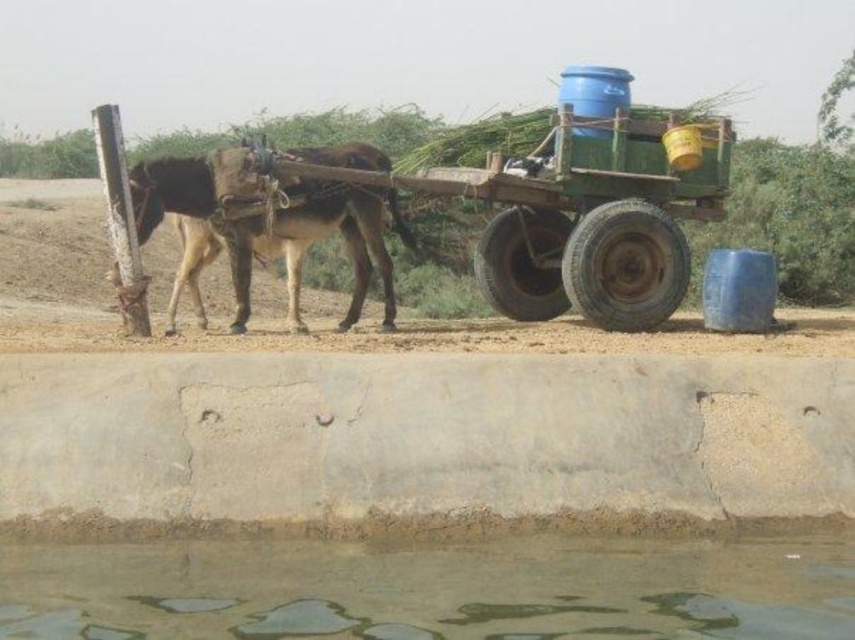
Is the position of clear water at lower center more distant than that of green wooden cart at center?

No, it is in front of green wooden cart at center.

Is point (99, 557) behind point (632, 243)?

No, (99, 557) is closer to viewer.

This screenshot has height=640, width=855. In order to click on clear water at lower center in this screenshot , I will do tap(433, 588).

Image resolution: width=855 pixels, height=640 pixels. In order to click on clear water at lower center in this screenshot , I will do `click(433, 588)`.

Between green wooden cart at center and brown rough donkey at left, which one appears on the left side from the viewer's perspective?

brown rough donkey at left

Who is positioned more to the right, green wooden cart at center or brown rough donkey at left?

From the viewer's perspective, green wooden cart at center appears more on the right side.

The height and width of the screenshot is (640, 855). Identify the location of green wooden cart at center. (528, 209).

Can you confirm if clear water at lower center is wider than brown rough donkey at left?

Indeed, clear water at lower center has a greater width compared to brown rough donkey at left.

How far apart are clear water at lower center and brown rough donkey at left?

A distance of 15.47 feet exists between clear water at lower center and brown rough donkey at left.

This screenshot has height=640, width=855. Describe the element at coordinates (433, 588) in the screenshot. I see `clear water at lower center` at that location.

Find the location of `clear water at lower center`. clear water at lower center is located at coordinates (433, 588).